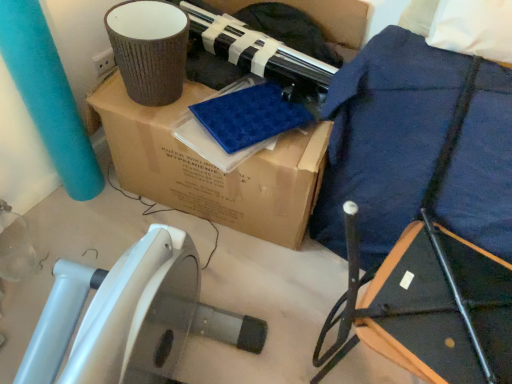
Question: In the image, is brown cardboard box at upper center on the left side or the right side of navy blue fabric at upper right?

Choices:
 (A) left
 (B) right

Answer: (A)

Question: Is brown cardboard box at upper center wider or thinner than navy blue fabric at upper right?

Choices:
 (A) wide
 (B) thin

Answer: (A)

Question: Would you say brown cardboard box at upper center is inside or outside navy blue fabric at upper right?

Choices:
 (A) outside
 (B) inside

Answer: (A)

Question: From the image's perspective, is navy blue fabric at upper right above or below brown cardboard box at upper center?

Choices:
 (A) above
 (B) below

Answer: (B)

Question: In the image, is navy blue fabric at upper right positioned in front of or behind brown cardboard box at upper center?

Choices:
 (A) front
 (B) behind

Answer: (A)

Question: In the image, is navy blue fabric at upper right on the left side or the right side of brown cardboard box at upper center?

Choices:
 (A) left
 (B) right

Answer: (B)

Question: In terms of size, does navy blue fabric at upper right appear bigger or smaller than brown cardboard box at upper center?

Choices:
 (A) small
 (B) big

Answer: (A)